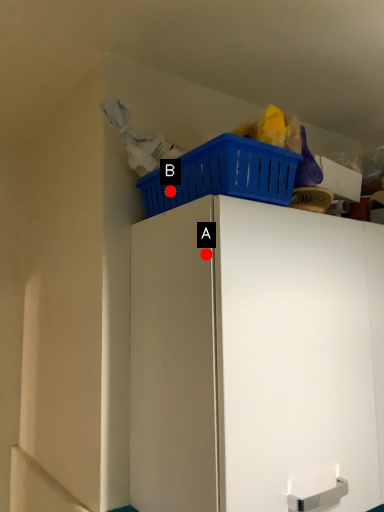
Question: Two points are circled on the image, labeled by A and B beside each circle. Which point is further to the camera?

Choices:
 (A) A is further
 (B) B is further

Answer: (B)